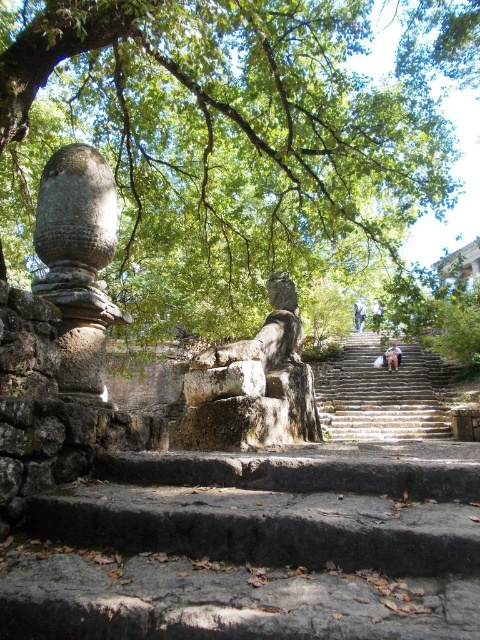
Question: Does green leafy tree at upper center have a larger size compared to stone textured stairs at center?

Choices:
 (A) no
 (B) yes

Answer: (B)

Question: Among these objects, which one is nearest to the camera?

Choices:
 (A) green leafy tree at upper center
 (B) stone textured stairs at center

Answer: (A)

Question: Among these objects, which one is nearest to the camera?

Choices:
 (A) stone textured stairs at center
 (B) green leafy tree at upper center

Answer: (B)

Question: Observing the image, what is the correct spatial positioning of green leafy tree at upper center in reference to stone textured stairs at center?

Choices:
 (A) below
 (B) above

Answer: (B)

Question: Does green leafy tree at upper center appear on the left side of stone textured stairs at center?

Choices:
 (A) no
 (B) yes

Answer: (B)